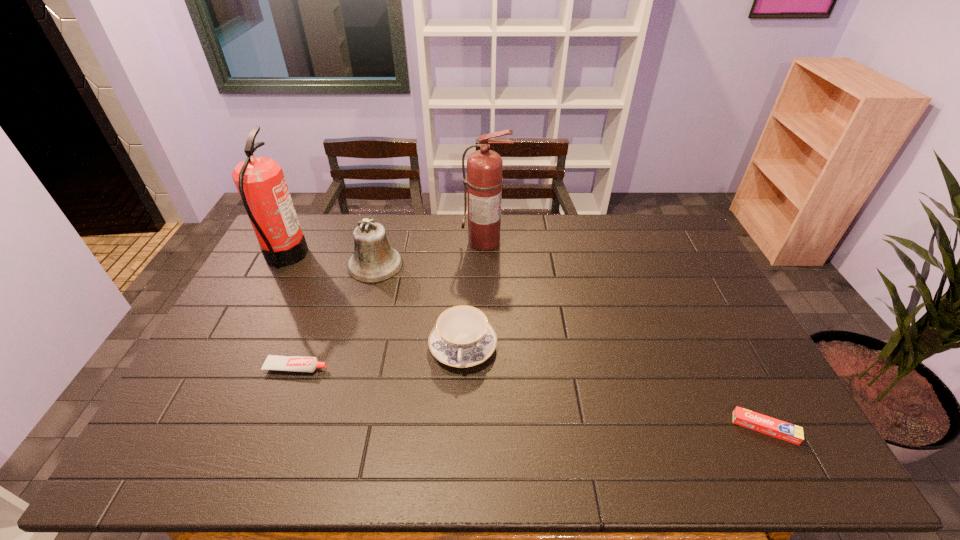
Locate an element on the screen. vacant space that satisfies the following two spatial constraints: 1. on the front side of the taller toothpaste; 2. on the right side of the leftmost object is located at coordinates (228, 367).